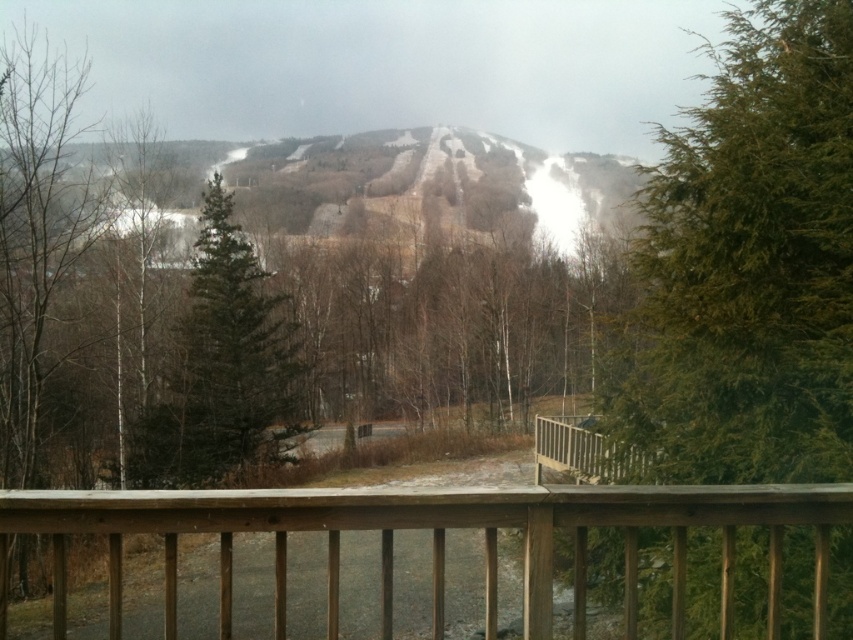
You are standing on the wooden deck and want to compare the height of the brown wooden railing at center and the green matte tree at center. Which one is taller?

The green matte tree at center is taller than the brown wooden railing at center.

You are standing on the wooden deck and looking at the green needle like tree at right. Where is the point (x=747, y=266) located?

The point (x=747, y=266) is located on the green needle like tree at right.